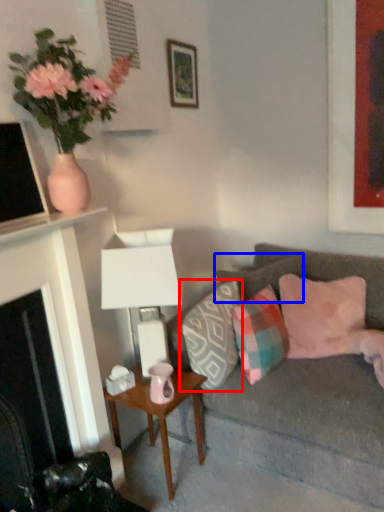
Question: Which object is closer to the camera taking this photo, pillow (highlighted by a red box) or pillow (highlighted by a blue box)?

Choices:
 (A) pillow
 (B) pillow

Answer: (A)